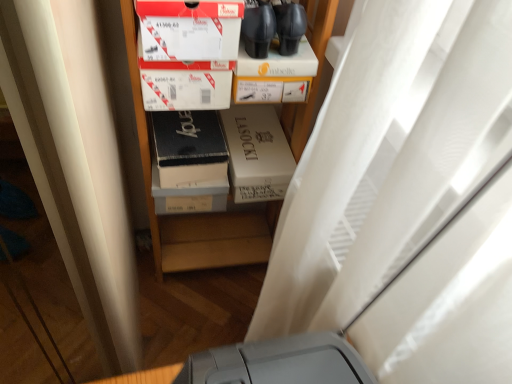
Locate an element on the screen. white matte shower curtain at upper center is located at coordinates (407, 204).

Describe the element at coordinates (407, 204) in the screenshot. I see `white matte shower curtain at upper center` at that location.

The height and width of the screenshot is (384, 512). Identify the location of white matte shower curtain at upper center. (407, 204).